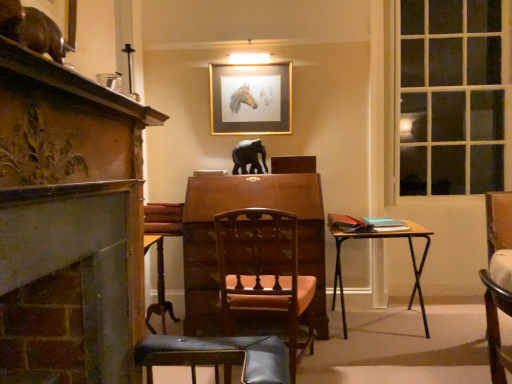
The height and width of the screenshot is (384, 512). What are the coordinates of `carved wood fireplace at left` in the screenshot? It's located at (75, 199).

What do you see at coordinates (249, 157) in the screenshot? The height and width of the screenshot is (384, 512). I see `brown glossy elephant at center, the second animal positioned from the front` at bounding box center [249, 157].

Describe the element at coordinates (264, 272) in the screenshot. I see `wooden chair with carved backrest at center, the 2th chair positioned from the left` at that location.

Describe the element at coordinates (380, 239) in the screenshot. I see `wooden table at right` at that location.

Identify the location of carved wood fireplace at left. This screenshot has width=512, height=384. (75, 199).

Considering the points (375, 234) and (85, 223), which point is in front, point (375, 234) or point (85, 223)?

The point (85, 223) is in front.

Where is `fireplace above the wooden table at right (from a real-world perspective)`? This screenshot has height=384, width=512. fireplace above the wooden table at right (from a real-world perspective) is located at coordinates (75, 199).

How many degrees apart are the facing directions of wooden table at right and carved wood fireplace at left?

The angular difference between wooden table at right and carved wood fireplace at left is 91.5 degrees.

Measure the distance from wooden table at right to carved wood fireplace at left.

6.60 feet.

Is point (242, 162) closer to viewer compared to point (24, 11)?

No, it is not.

I want to click on animal above the brown glossy elephant at center, positioned as the 1th animal in back-to-front order (from the image's perspective), so click(32, 29).

Consider the image. Is brown glossy elephant at center, the 2th animal positioned from the left, shorter than shiny brown cat at upper left, the first animal in the front-to-back sequence?

Incorrect, the height of brown glossy elephant at center, the 2th animal positioned from the left, does not fall short of that of shiny brown cat at upper left, the first animal in the front-to-back sequence.

How much distance is there between brown glossy elephant at center, acting as the 1th animal starting from the right, and shiny brown cat at upper left, placed as the 2th animal when sorted from back to front?

brown glossy elephant at center, acting as the 1th animal starting from the right, and shiny brown cat at upper left, placed as the 2th animal when sorted from back to front, are 6.84 feet apart from each other.

Between wooden chair at right, which is the third chair from left to right, and shiny brown cat at upper left, placed as the 2th animal when sorted from back to front, which one is positioned in front?

shiny brown cat at upper left, placed as the 2th animal when sorted from back to front, is more forward.

Could you tell me if wooden chair at right, marked as the 1th chair in a right-to-left arrangement, is turned towards shiny brown cat at upper left, placed as the 2th animal when sorted from back to front?

No, wooden chair at right, marked as the 1th chair in a right-to-left arrangement, is not turned towards shiny brown cat at upper left, placed as the 2th animal when sorted from back to front.

Looking at this image, how many degrees apart are the facing directions of wooden chair at right, which is the third chair from left to right, and shiny brown cat at upper left, placed as the 2th animal when sorted from back to front?

They differ by 87.6 degrees in their facing directions.

From a real-world perspective, between wooden chair at right, which is the third chair from left to right, and shiny brown cat at upper left, arranged as the 1th animal when viewed from the left, who is vertically lower?

wooden chair at right, which is the third chair from left to right.

Is wooden chair at right, which is the third chair from left to right, in front of or behind brown glossy elephant at center, the second animal positioned from the front, in the image?

Clearly, wooden chair at right, which is the third chair from left to right, is in front of brown glossy elephant at center, the second animal positioned from the front.

Does wooden chair at right, which is the third chair from left to right, turn towards brown glossy elephant at center, the 2th animal positioned from the left?

No, wooden chair at right, which is the third chair from left to right, is not turned towards brown glossy elephant at center, the 2th animal positioned from the left.

The width and height of the screenshot is (512, 384). What are the coordinates of `animal lying behind the wooden chair at right, which is the third chair from left to right` in the screenshot? It's located at click(249, 157).

From the image's perspective, is wooden chair at right, which is the third chair from left to right, above brown glossy elephant at center, the second animal positioned from the front?

No.

Who is shorter, carved wood fireplace at left or shiny brown cat at upper left, placed as the 2th animal when sorted from back to front?

With less height is shiny brown cat at upper left, placed as the 2th animal when sorted from back to front.

Is carved wood fireplace at left next to shiny brown cat at upper left, which is counted as the second animal, starting from the right?

No, carved wood fireplace at left is not in contact with shiny brown cat at upper left, which is counted as the second animal, starting from the right.

Which is farther from the camera, (128,144) or (8,26)?

Positioned behind is point (128,144).

Is carved wood fireplace at left looking in the opposite direction of shiny brown cat at upper left, which is counted as the second animal, starting from the right?

No, carved wood fireplace at left is not facing away from shiny brown cat at upper left, which is counted as the second animal, starting from the right.

In the scene shown: Is wooden chair at center, the 1th chair positioned from the left, placed right next to wooden chair at right, marked as the 1th chair in a right-to-left arrangement?

No, wooden chair at center, the 1th chair positioned from the left, is not making contact with wooden chair at right, marked as the 1th chair in a right-to-left arrangement.

Would you say wooden chair at center, which is counted as the third chair, starting from the right, is inside or outside wooden chair at right, which is the third chair from left to right?

wooden chair at center, which is counted as the third chair, starting from the right, is not enclosed by wooden chair at right, which is the third chair from left to right.

From a real-world perspective, is wooden chair at center, the 1th chair positioned from the left, above or below wooden chair at right, which is the third chair from left to right?

wooden chair at center, the 1th chair positioned from the left, is situated lower than wooden chair at right, which is the third chair from left to right, in the real world.

Where is `chair that is the 2nd one when counting downward from the wooden chair at right, marked as the 1th chair in a right-to-left arrangement (from the image's perspective)`? chair that is the 2nd one when counting downward from the wooden chair at right, marked as the 1th chair in a right-to-left arrangement (from the image's perspective) is located at coordinates (161, 251).

Considering the positions of objects wooden chair with carved backrest at center, the 2th chair positioned from the left, and brown glossy elephant at center, acting as the 1th animal starting from the right, in the image provided, who is more to the right, wooden chair with carved backrest at center, the 2th chair positioned from the left, or brown glossy elephant at center, acting as the 1th animal starting from the right,?

From the viewer's perspective, wooden chair with carved backrest at center, the 2th chair positioned from the left, appears more on the right side.

Is the surface of wooden chair with carved backrest at center, the 2th chair positioned from the left, in direct contact with brown glossy elephant at center, acting as the 1th animal starting from the right?

wooden chair with carved backrest at center, the 2th chair positioned from the left, is not next to brown glossy elephant at center, acting as the 1th animal starting from the right, and they're not touching.

Relative to brown glossy elephant at center, positioned as the 1th animal in back-to-front order, is wooden chair with carved backrest at center, the 2th chair positioned from the left, in front or behind?

wooden chair with carved backrest at center, the 2th chair positioned from the left, is positioned closer to the viewer than brown glossy elephant at center, positioned as the 1th animal in back-to-front order.

Considering the relative sizes of wooden chair with carved backrest at center, the 2th chair positioned from the left, and brown glossy elephant at center, positioned as the 1th animal in back-to-front order, in the image provided, is wooden chair with carved backrest at center, the 2th chair positioned from the left, taller than brown glossy elephant at center, positioned as the 1th animal in back-to-front order,?

Yes, wooden chair with carved backrest at center, the 2th chair positioned from the left, is taller than brown glossy elephant at center, positioned as the 1th animal in back-to-front order.

This screenshot has height=384, width=512. Find the location of `fireplace located in front of the wooden table at right`. fireplace located in front of the wooden table at right is located at coordinates (75, 199).

Identify the location of animal on the left of brown glossy elephant at center, positioned as the 1th animal in back-to-front order. The height and width of the screenshot is (384, 512). (32, 29).

Looking at the image, which one is located closer to wooden table at right, shiny brown cat at upper left, placed as the 2th animal when sorted from back to front, or wooden chair at center, which is counted as the third chair, starting from the right?

wooden chair at center, which is counted as the third chair, starting from the right, is positioned closer to the anchor wooden table at right.

Based on their spatial positions, is wooden chair at right, which is the third chair from left to right, or brown glossy elephant at center, the second animal positioned from the front, further from clear glass window at right?

wooden chair at right, which is the third chair from left to right, is positioned further to the anchor clear glass window at right.

Estimate the real-world distances between objects in this image. Which object is closer to shiny brown cat at upper left, which is counted as the second animal, starting from the right, wooden chair at center, which is counted as the third chair, starting from the right, or wooden chair at right, marked as the 1th chair in a right-to-left arrangement?

wooden chair at right, marked as the 1th chair in a right-to-left arrangement, is closer to shiny brown cat at upper left, which is counted as the second animal, starting from the right.

From the image, which object appears to be farther from wooden table at right, clear glass window at right or shiny brown cat at upper left, arranged as the 1th animal when viewed from the left?

shiny brown cat at upper left, arranged as the 1th animal when viewed from the left, lies further to wooden table at right than the other object.

Estimate the real-world distances between objects in this image. Which object is closer to shiny brown cat at upper left, the first animal in the front-to-back sequence, wooden chair at center, which is counted as the third chair, starting from the right, or wooden chair with carved backrest at center, the 2th chair positioned from the left?

The object closer to shiny brown cat at upper left, the first animal in the front-to-back sequence, is wooden chair with carved backrest at center, the 2th chair positioned from the left.

Looking at this image, estimate the real-world distances between objects in this image. Which object is closer to clear glass window at right, brown glossy elephant at center, positioned as the 1th animal in back-to-front order, or gold metallic picture frame at upper center?

Among the two, gold metallic picture frame at upper center is located nearer to clear glass window at right.

Estimate the real-world distances between objects in this image. Which object is further from carved wood fireplace at left, brown glossy elephant at center, the second animal positioned from the front, or wooden chair at center, the 1th chair positioned from the left?

Based on the image, brown glossy elephant at center, the second animal positioned from the front, appears to be further to carved wood fireplace at left.

Considering their positions, is shiny brown cat at upper left, the first animal in the front-to-back sequence, positioned further to wooden table at right than wooden chair with carved backrest at center, the 2th chair from the right?

shiny brown cat at upper left, the first animal in the front-to-back sequence, is further to wooden table at right.

You are a GUI agent. You are given a task and a screenshot of the screen. Output one action in this format:
    pyautogui.click(x=<x>, y=<y>)
    Task: Click on the picture frame between brown glossy elephant at center, acting as the 1th animal starting from the right, and wooden chair at right, marked as the 1th chair in a right-to-left arrangement
    The image size is (512, 384).
    Given the screenshot: What is the action you would take?
    pyautogui.click(x=251, y=98)

The image size is (512, 384). I want to click on table situated between wooden chair with carved backrest at center, the 2th chair positioned from the left, and clear glass window at right from left to right, so click(x=380, y=239).

Identify the location of fireplace situated between shiny brown cat at upper left, the first animal in the front-to-back sequence, and wooden chair at right, which is the third chair from left to right, from left to right. (75, 199).

What are the coordinates of `table positioned between carved wood fireplace at left and gold metallic picture frame at upper center from near to far` in the screenshot? It's located at (380, 239).